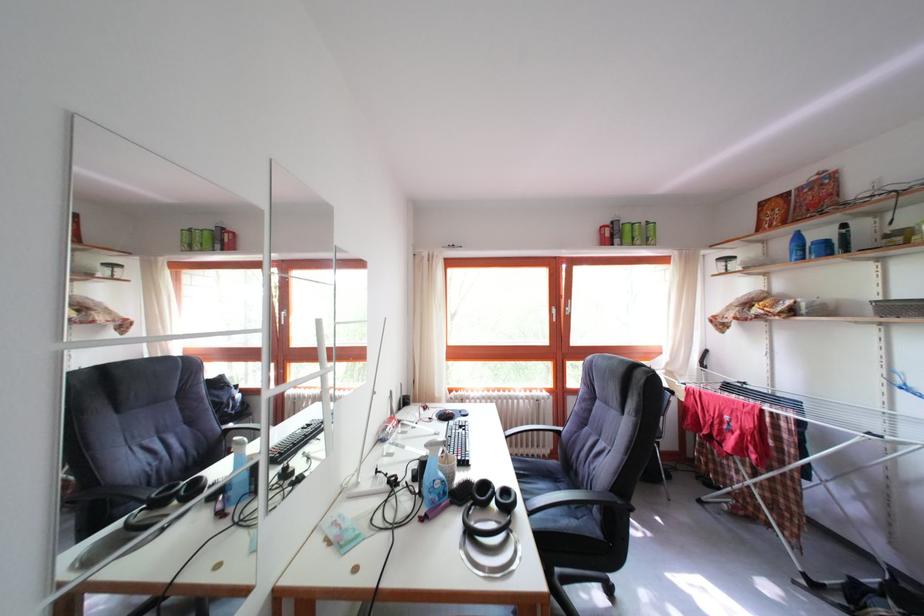
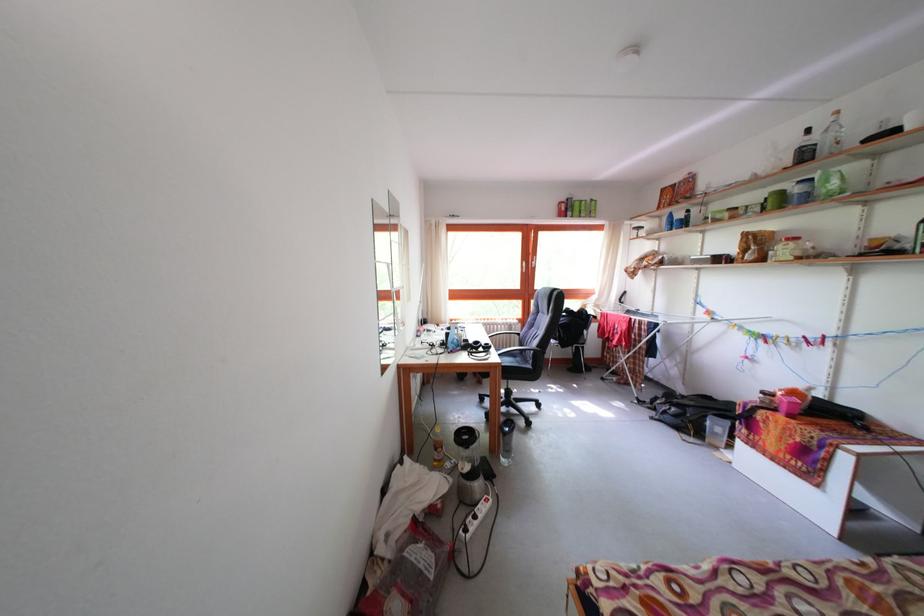
In the second image, find the point that corresponds to point (524, 509) in the first image.

(499, 354)